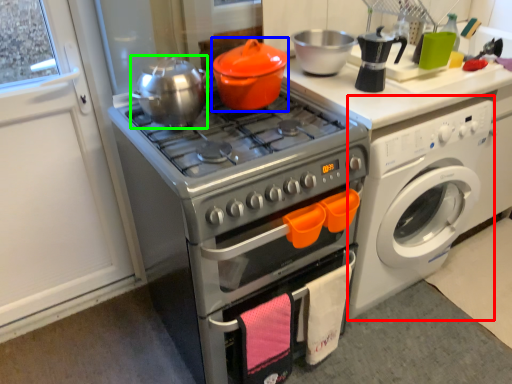
Question: Which object is the closest to the washing machine (highlighted by a red box)? Choose among these: crock pot (highlighted by a blue box) or tea pot (highlighted by a green box).

Choices:
 (A) crock pot
 (B) tea pot

Answer: (A)